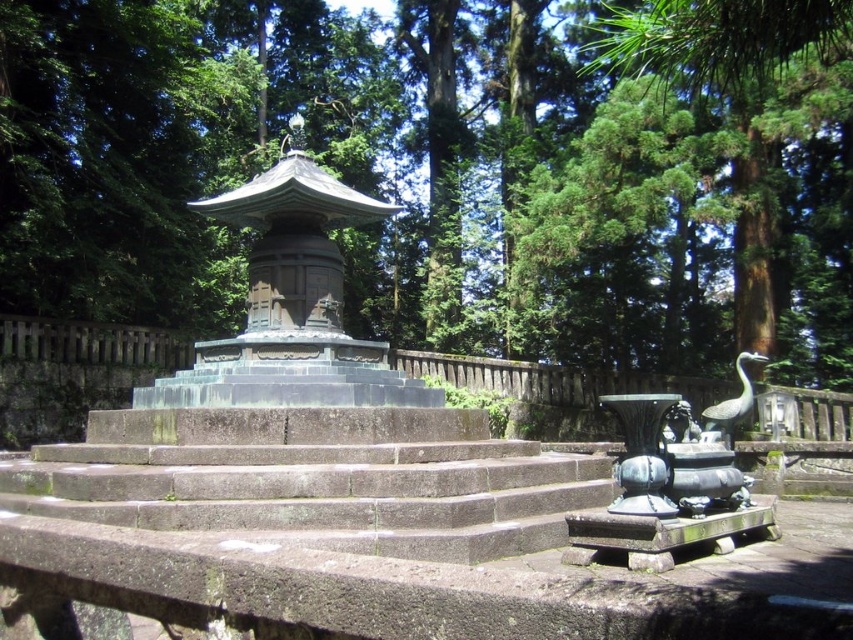
Question: Which point is farther to the camera?

Choices:
 (A) gray stone stairs at center
 (B) green leafy tree at center

Answer: (A)

Question: Is green leafy tree at center closer to the viewer compared to gray stone stairs at center?

Choices:
 (A) no
 (B) yes

Answer: (B)

Question: Is green leafy tree at center wider than gray stone stairs at center?

Choices:
 (A) yes
 (B) no

Answer: (A)

Question: Does green leafy tree at center have a larger size compared to gray stone stairs at center?

Choices:
 (A) no
 (B) yes

Answer: (B)